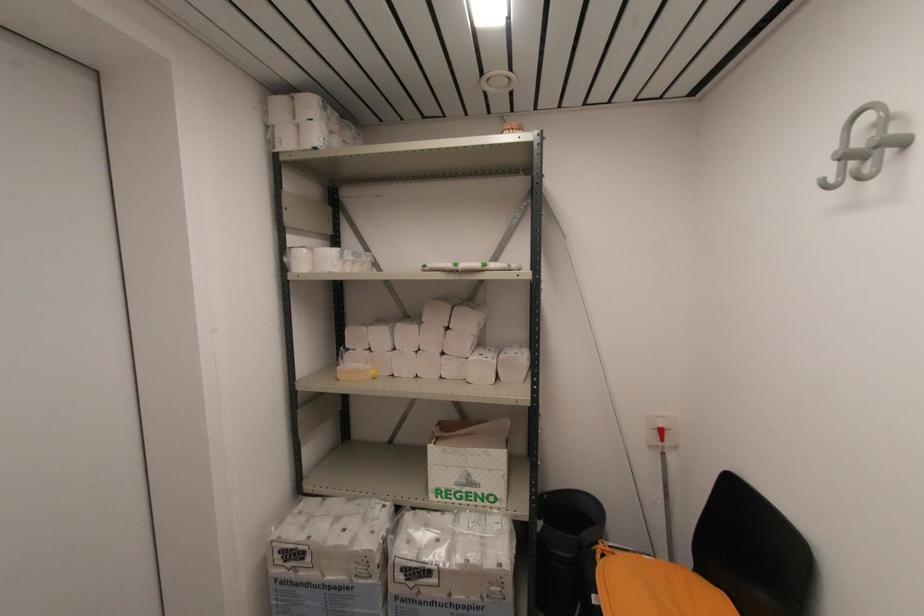
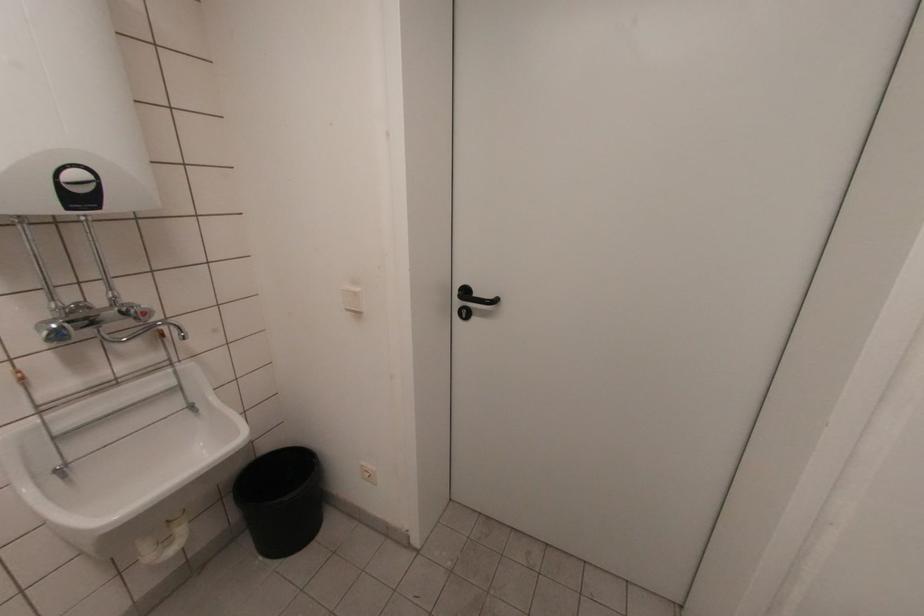
First-person continuous shooting, in which direction is the camera rotating?

The camera's rotation is toward left-down.